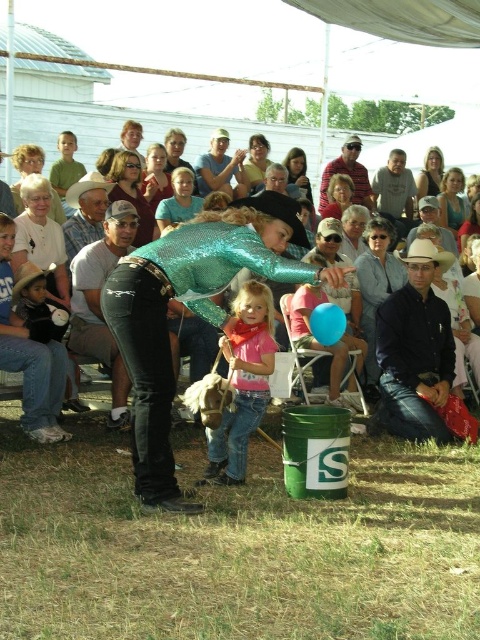
Question: Is smooth brown hair at upper right thinner than matte brown hair at upper center?

Choices:
 (A) no
 (B) yes

Answer: (A)

Question: Which object is farther from the camera taking this photo?

Choices:
 (A) black leather jacket at center
 (B) matte brown hair at center
 (C) matte brown hair at upper center
 (D) shiny sequined dress at center

Answer: (C)

Question: Considering the real-world distances, which object is farthest from the smooth skin face at center?

Choices:
 (A) matte yellow shirt at center
 (B) matte black glasses at upper left
 (C) denim jacket at center
 (D) pink matte shirt at center

Answer: (D)

Question: Does matte gray shirt at upper center appear on the right side of matte yellow shirt at center?

Choices:
 (A) yes
 (B) no

Answer: (A)

Question: Is shiny teal shirt at center bigger than matte white shirt at center?

Choices:
 (A) yes
 (B) no

Answer: (A)

Question: Considering the real-world distances, which object is closest to the matte black shirt at upper center?

Choices:
 (A) matte yellow shirt at center
 (B) matte white shirt at center
 (C) matte black cowboy hat at upper center

Answer: (A)